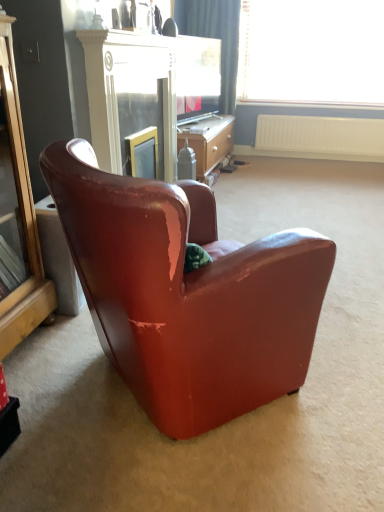
Question: Is gold mirrored cabinet at left taller or shorter than white plastic radiator at upper right?

Choices:
 (A) tall
 (B) short

Answer: (A)

Question: Is gold mirrored cabinet at left in front of or behind white plastic radiator at upper right in the image?

Choices:
 (A) behind
 (B) front

Answer: (B)

Question: Considering the real-world distances, which object is closest to the leather armchair at center?

Choices:
 (A) matte glass screen door at upper center
 (B) matte black television at center
 (C) transparent glass window at upper center
 (D) gold mirrored cabinet at left
 (E) white plastic radiator at upper right

Answer: (D)

Question: Which object is the closest to the transparent glass window at upper center?

Choices:
 (A) matte glass screen door at upper center
 (B) wooden desk at center
 (C) matte black television at center
 (D) white plastic radiator at upper right
 (E) gold mirrored cabinet at left

Answer: (D)